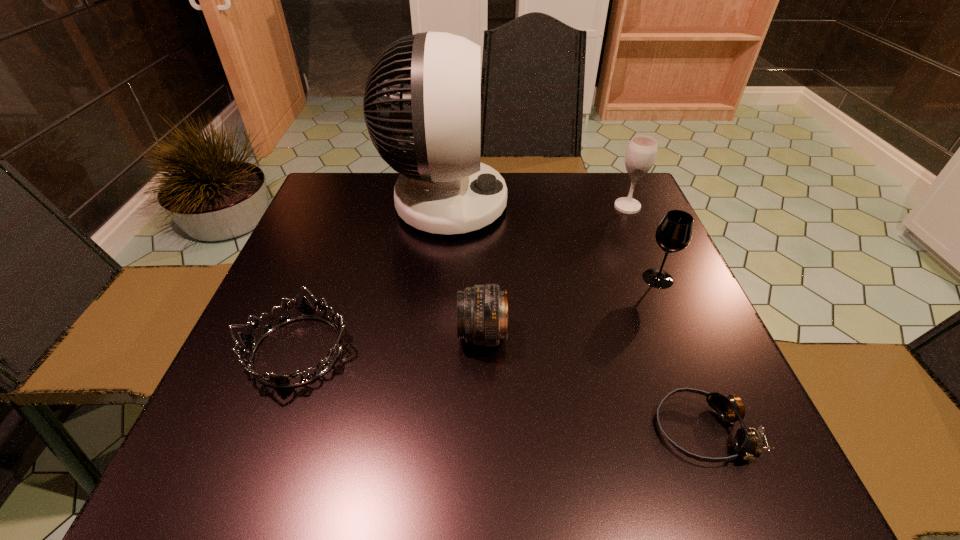
Locate an element on the screen. The width and height of the screenshot is (960, 540). free space located at the front element of the third shortest object is located at coordinates coord(391,335).

Image resolution: width=960 pixels, height=540 pixels. In order to click on vacant area situated 0.050m at the front element of the third shortest object in this screenshot , I will do `click(433, 335)`.

Locate an element on the screen. This screenshot has width=960, height=540. vacant area situated 0.120m on the front-facing side of the tiara is located at coordinates (252, 471).

Image resolution: width=960 pixels, height=540 pixels. In order to click on vacant region located through the lenses of the goggles in this screenshot , I will do `click(412, 430)`.

Identify the location of vacant space situated through the lenses of the goggles. The image size is (960, 540). (468, 430).

This screenshot has height=540, width=960. What are the coordinates of `blank area located 0.350m through the lenses of the goggles` in the screenshot? It's located at (437, 430).

Image resolution: width=960 pixels, height=540 pixels. I want to click on fan that is at the far edge, so click(x=443, y=188).

The image size is (960, 540). I want to click on wineglass that is at the far edge, so click(641, 152).

This screenshot has height=540, width=960. In order to click on object positioned at the near edge in this screenshot , I will do `click(748, 442)`.

Locate an element on the screen. object at the left edge is located at coordinates [306, 310].